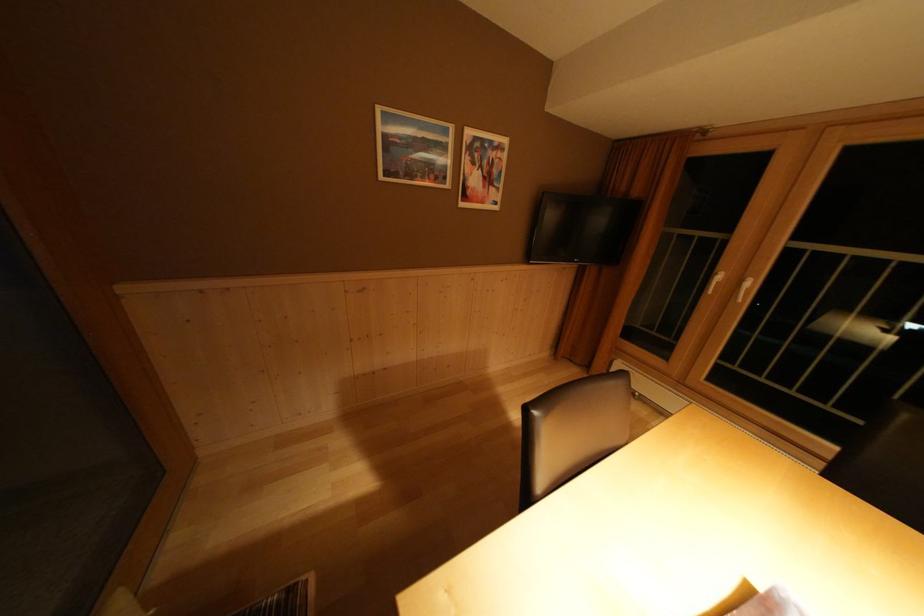
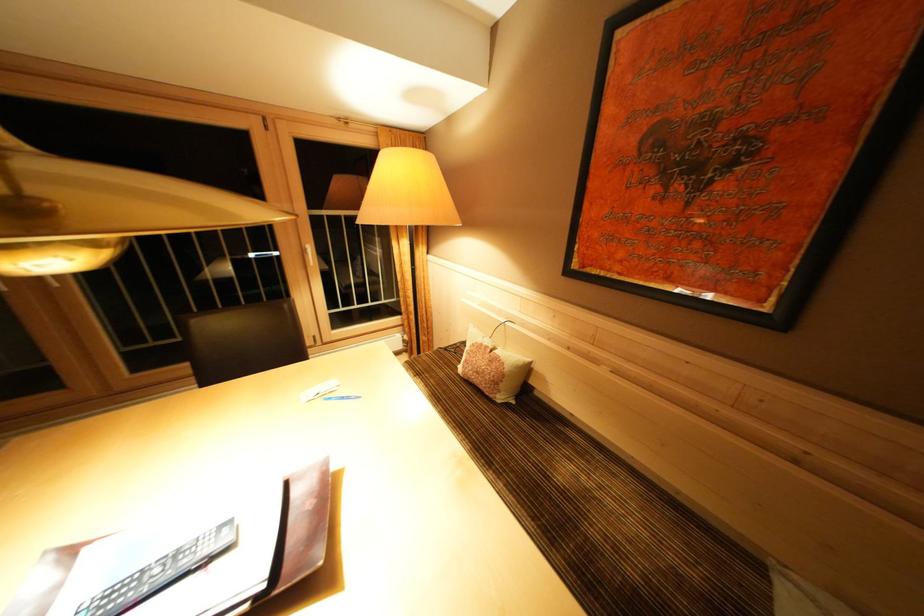
The images are taken continuously from a first-person perspective. In which direction is your viewpoint rotating?

The rotation direction of the camera is right-down.